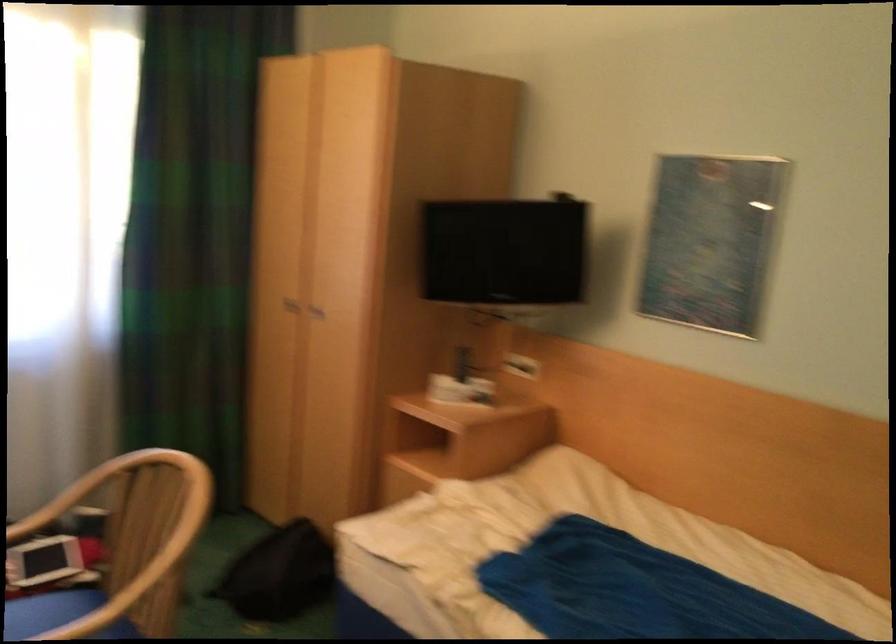
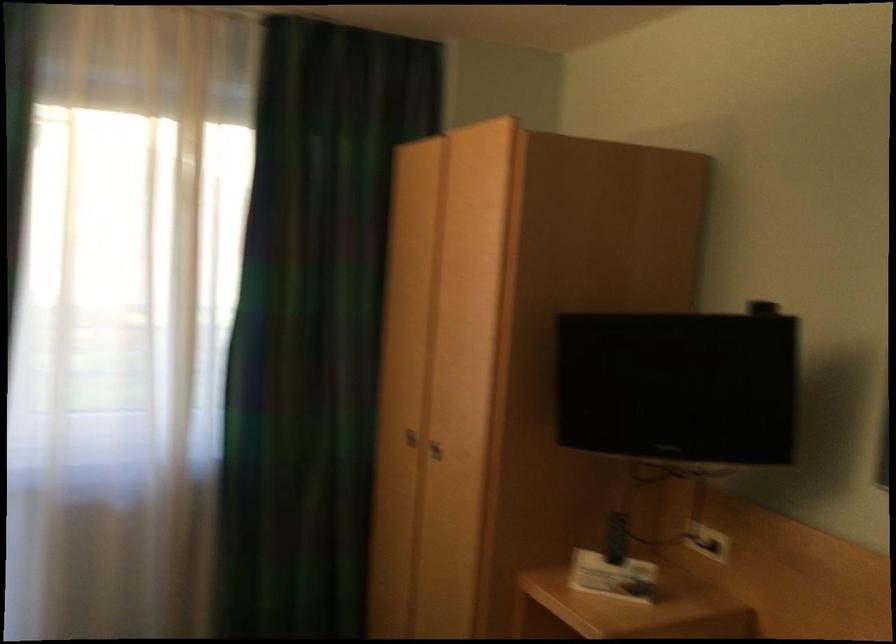
In the second image, find the point that corresponds to the point at 316,310 in the first image.

(435, 450)